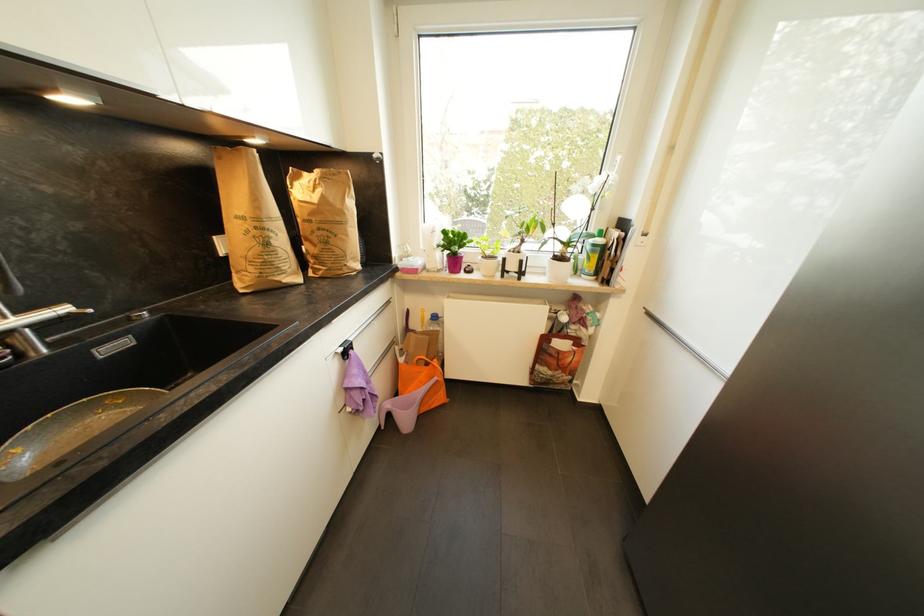
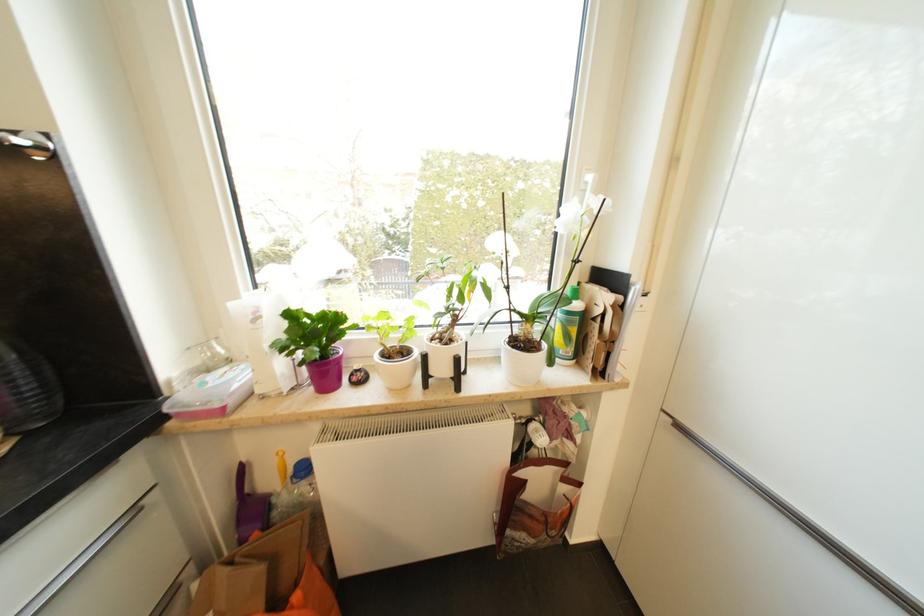
Where in the second image is the point corresponding to point 653,315 from the first image?

(685, 429)